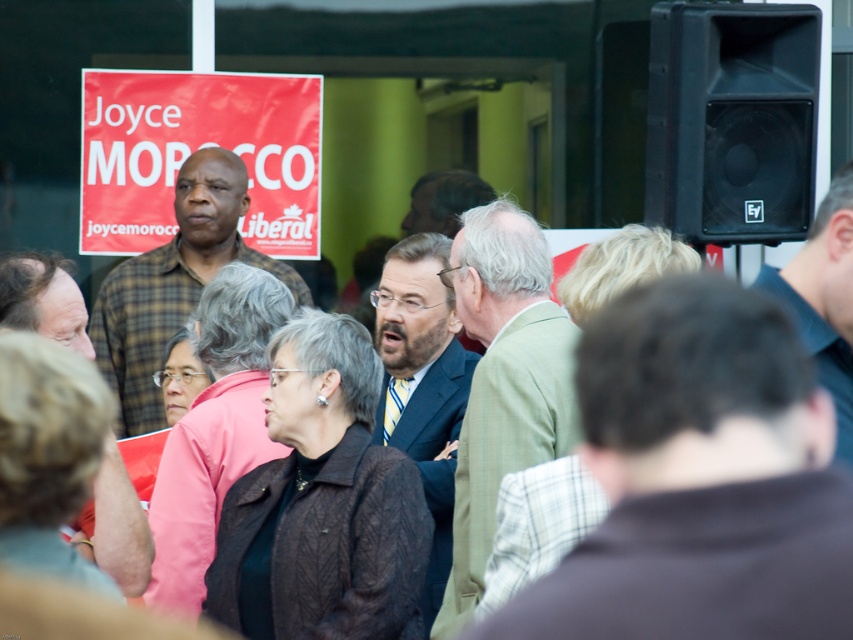
Question: Does black plastic speaker at upper right have a smaller size compared to red plastic sign at center?

Choices:
 (A) no
 (B) yes

Answer: (A)

Question: Is the position of black plastic speaker at upper right less distant than that of red plastic sign at center?

Choices:
 (A) yes
 (B) no

Answer: (A)

Question: Is black plastic speaker at upper right wider than red plastic sign at center?

Choices:
 (A) yes
 (B) no

Answer: (B)

Question: Which of the following is the farthest from the observer?

Choices:
 (A) (256, 96)
 (B) (735, 208)

Answer: (A)

Question: Among these objects, which one is farthest from the camera?

Choices:
 (A) black plastic speaker at upper right
 (B) red plastic sign at center

Answer: (B)

Question: Which object is closer to the camera taking this photo?

Choices:
 (A) black plastic speaker at upper right
 (B) red plastic sign at center

Answer: (A)